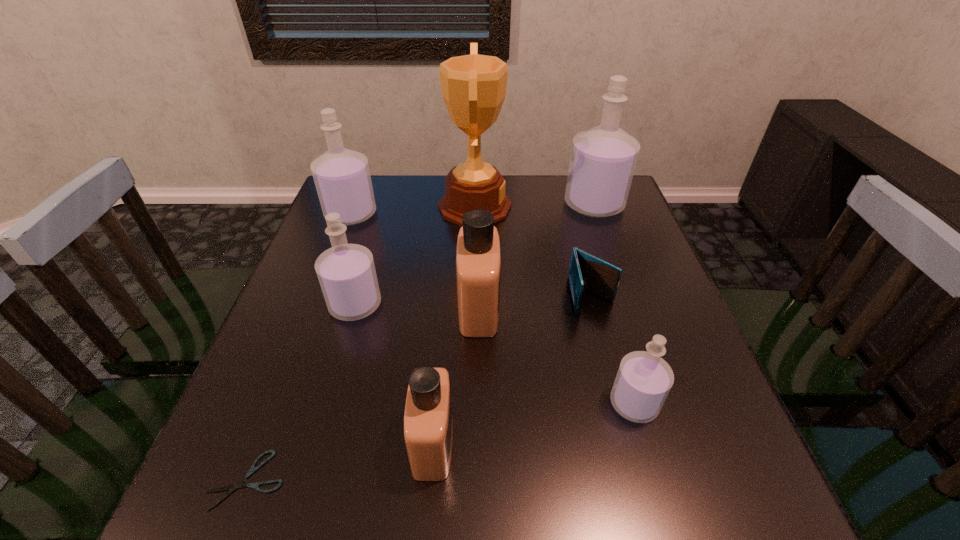
The height and width of the screenshot is (540, 960). What are the coordinates of `blank space that satisfies the following two spatial constraints: 1. on the front-facing side of the award; 2. on the front side of the black shears` in the screenshot? It's located at (470, 480).